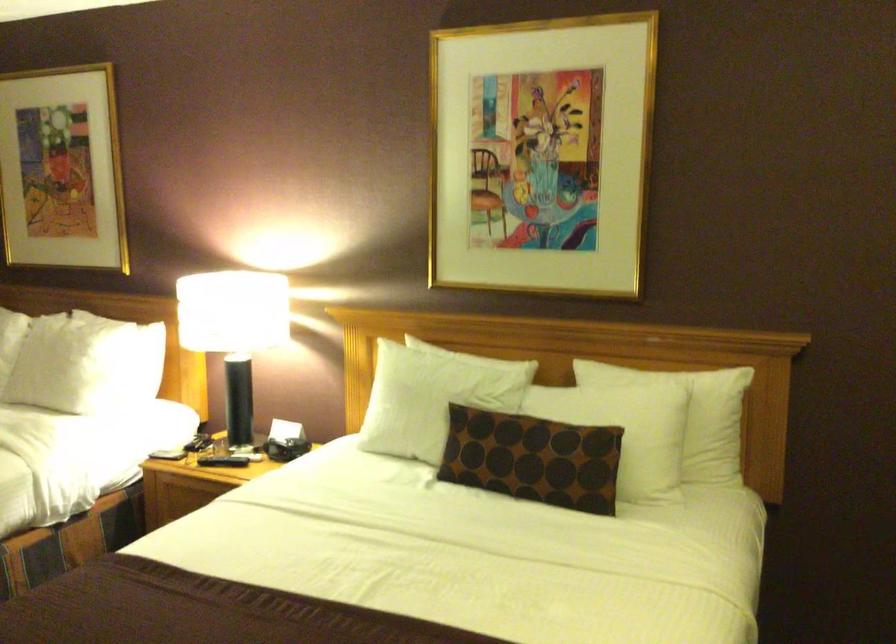
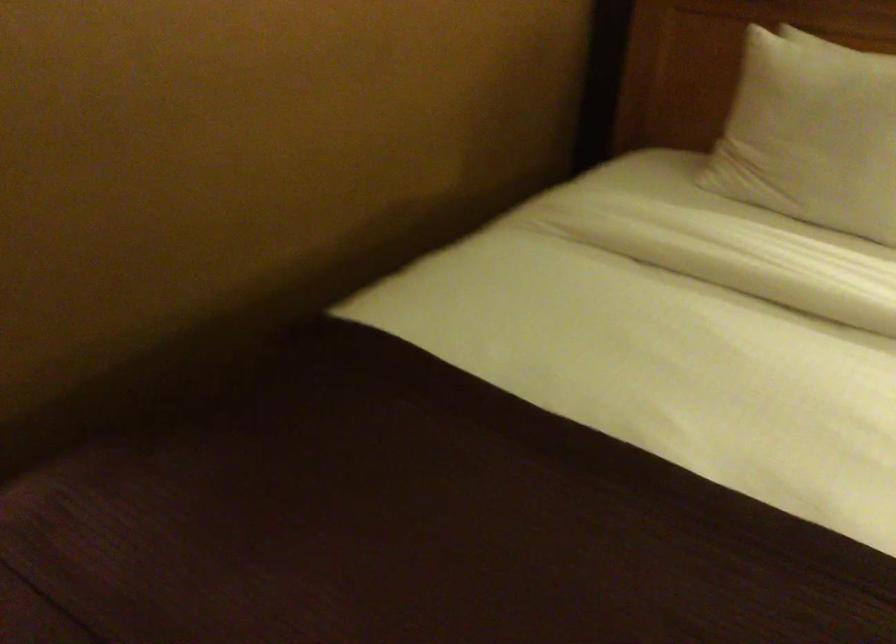
What movement of the cameraman would produce the second image?

The cameraman moved toward left, forward.